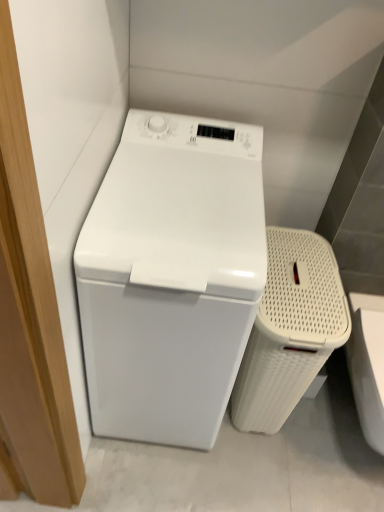
Question: Is white woven laundry basket at right closer to camera compared to white glossy washing machine at left?

Choices:
 (A) yes
 (B) no

Answer: (B)

Question: From the image's perspective, is white woven laundry basket at right on white glossy washing machine at left?

Choices:
 (A) yes
 (B) no

Answer: (B)

Question: Is white woven laundry basket at right shorter than white glossy washing machine at left?

Choices:
 (A) yes
 (B) no

Answer: (A)

Question: From a real-world perspective, is white woven laundry basket at right on white glossy washing machine at left?

Choices:
 (A) no
 (B) yes

Answer: (A)

Question: From a real-world perspective, is white woven laundry basket at right located beneath white glossy washing machine at left?

Choices:
 (A) no
 (B) yes

Answer: (B)

Question: Considering the relative sizes of white woven laundry basket at right and white glossy washing machine at left in the image provided, is white woven laundry basket at right thinner than white glossy washing machine at left?

Choices:
 (A) no
 (B) yes

Answer: (B)

Question: Is white glossy washing machine at left not inside white woven laundry basket at right?

Choices:
 (A) yes
 (B) no

Answer: (A)

Question: Is white glossy washing machine at left in front of white woven laundry basket at right?

Choices:
 (A) no
 (B) yes

Answer: (B)

Question: Is white glossy washing machine at left facing away from white woven laundry basket at right?

Choices:
 (A) no
 (B) yes

Answer: (A)

Question: From a real-world perspective, does white glossy washing machine at left sit lower than white woven laundry basket at right?

Choices:
 (A) no
 (B) yes

Answer: (A)

Question: Are white glossy washing machine at left and white woven laundry basket at right beside each other?

Choices:
 (A) no
 (B) yes

Answer: (A)

Question: Can you confirm if white glossy washing machine at left is shorter than white woven laundry basket at right?

Choices:
 (A) yes
 (B) no

Answer: (B)

Question: From the image's perspective, relative to white woven laundry basket at right, is white glossy washing machine at left above or below?

Choices:
 (A) above
 (B) below

Answer: (A)